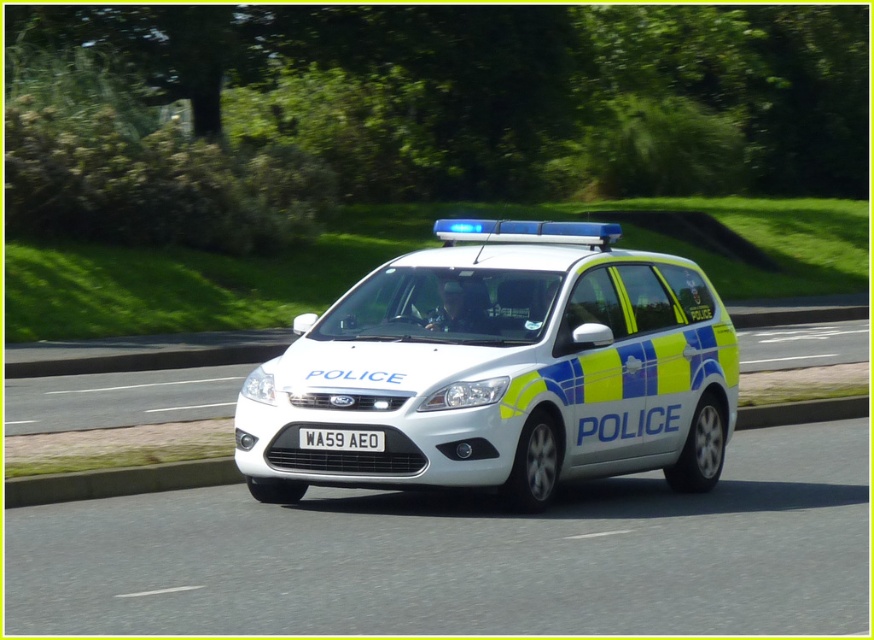
Does white glossy police car at center have a greater width compared to white plastic license plate at center?

Yes.

From the picture: Can you confirm if white glossy police car at center is shorter than white plastic license plate at center?

In fact, white glossy police car at center may be taller than white plastic license plate at center.

Which is in front, point (695, 332) or point (362, 444)?

Point (362, 444)

This screenshot has width=874, height=640. I want to click on white glossy police car at center, so click(501, 369).